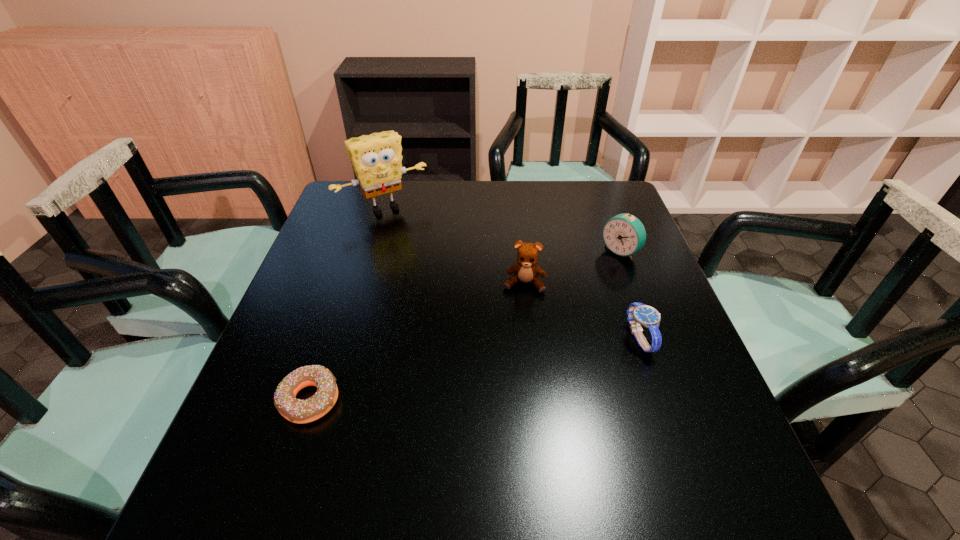
The image size is (960, 540). I want to click on vacant space located 0.340m on the left of the fourth tallest object, so click(x=474, y=338).

The width and height of the screenshot is (960, 540). I want to click on free spot located 0.110m on the front-facing side of the teddy bear, so click(518, 328).

You are a GUI agent. You are given a task and a screenshot of the screen. Output one action in this format:
    pyautogui.click(x=<x>, y=<y>)
    Task: Click on the vacant space located 0.150m on the front-facing side of the teddy bear
    This screenshot has width=960, height=540.
    Given the screenshot: What is the action you would take?
    pyautogui.click(x=516, y=341)

The height and width of the screenshot is (540, 960). Identify the location of free location located on the front-facing side of the teddy bear. (507, 422).

Find the location of a particular element. This screenshot has width=960, height=540. blank space located 0.300m on the front-facing side of the second farthest object is located at coordinates (536, 317).

Locate an element on the screen. The image size is (960, 540). free space located 0.310m on the front-facing side of the second farthest object is located at coordinates (533, 319).

Where is `blank area located 0.360m on the front-facing side of the second farthest object`? blank area located 0.360m on the front-facing side of the second farthest object is located at coordinates (518, 330).

This screenshot has height=540, width=960. Find the location of `free spot located 0.380m on the face of the farthest object`. free spot located 0.380m on the face of the farthest object is located at coordinates (460, 298).

Identify the location of vacant area located 0.120m on the face of the farthest object. (418, 241).

The image size is (960, 540). In order to click on vacant point located on the face of the farthest object in this screenshot , I will do `click(462, 301)`.